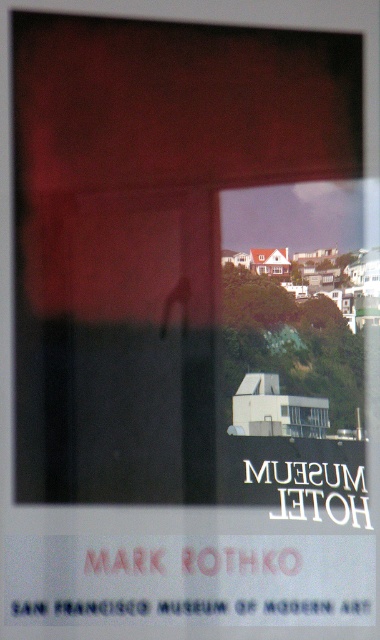
Which is behind, point (277, 273) or point (264, 268)?

Positioned behind is point (264, 268).

Between transparent glass window at center and matte glass window at center, which one is positioned lower?

transparent glass window at center is lower down.

The height and width of the screenshot is (640, 380). Identify the location of transparent glass window at center. (277, 269).